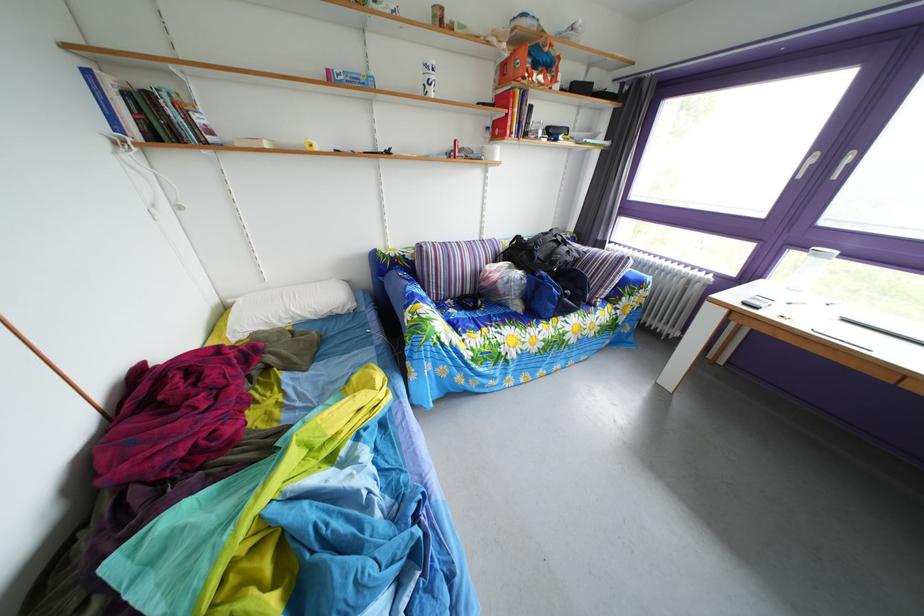
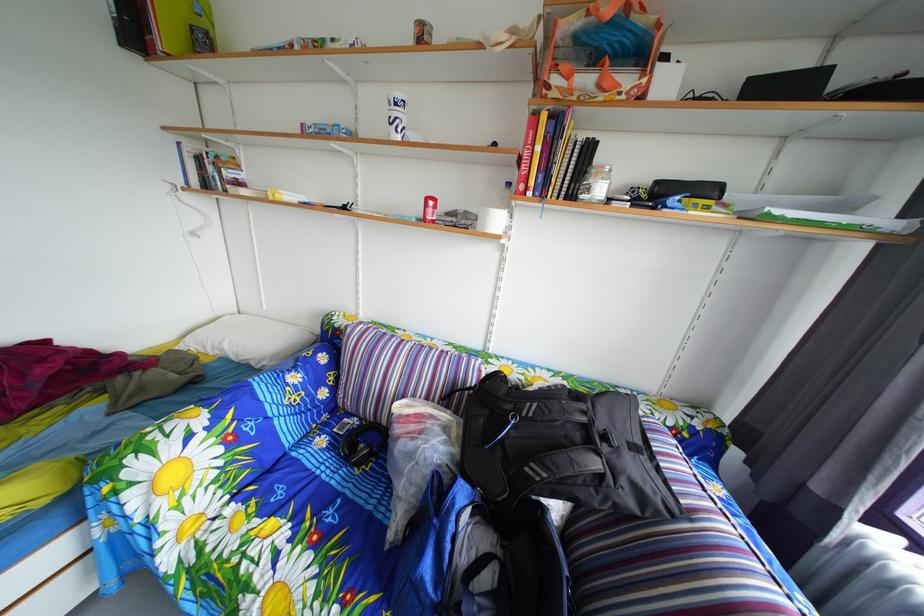
Locate, in the second image, the point that corresponds to (459,310) in the first image.

(367, 428)